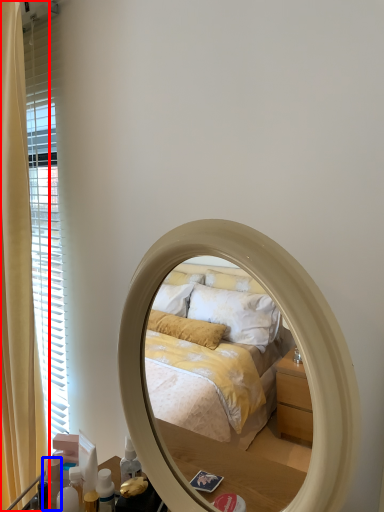
Question: Which object appears closest to the camera in this image, curtain (highlighted by a red box) or toiletry (highlighted by a blue box)?

Choices:
 (A) curtain
 (B) toiletry

Answer: (A)